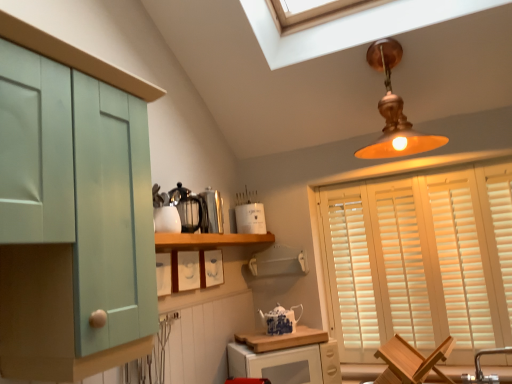
Question: Does wooden cutting board at lower center turn towards metallic silver kettle at center, placed as the 2th appliance when sorted from back to front?

Choices:
 (A) no
 (B) yes

Answer: (A)

Question: Does wooden cutting board at lower center have a lesser height compared to metallic silver kettle at center, which is counted as the 2th appliance, starting from the front?

Choices:
 (A) no
 (B) yes

Answer: (B)

Question: Does wooden cutting board at lower center have a larger size compared to metallic silver kettle at center, which is counted as the 2th appliance, starting from the front?

Choices:
 (A) no
 (B) yes

Answer: (B)

Question: From the image's perspective, is wooden cutting board at lower center above metallic silver kettle at center, placed as the 2th appliance when sorted from back to front?

Choices:
 (A) yes
 (B) no

Answer: (B)

Question: Can you confirm if wooden cutting board at lower center is thinner than metallic silver kettle at center, which is counted as the 2th appliance, starting from the front?

Choices:
 (A) no
 (B) yes

Answer: (A)

Question: Considering the positions of polished stainless steel kettle at upper center, acting as the first appliance starting from the front, and wooden chair at lower right in the image, is polished stainless steel kettle at upper center, acting as the first appliance starting from the front, bigger or smaller than wooden chair at lower right?

Choices:
 (A) small
 (B) big

Answer: (A)

Question: Is point (198, 208) positioned closer to the camera than point (412, 372)?

Choices:
 (A) farther
 (B) closer

Answer: (A)

Question: From their relative heights in the image, would you say polished stainless steel kettle at upper center, acting as the first appliance starting from the front, is taller or shorter than wooden chair at lower right?

Choices:
 (A) tall
 (B) short

Answer: (B)

Question: Is polished stainless steel kettle at upper center, acting as the third appliance starting from the back, spatially inside wooden chair at lower right, or outside of it?

Choices:
 (A) inside
 (B) outside

Answer: (B)

Question: Is brushed metal faucet at lower right wider or thinner than mint green wood cabinet at left, marked as the 1th cabinetry in a left-to-right arrangement?

Choices:
 (A) thin
 (B) wide

Answer: (A)

Question: Considering the positions of brushed metal faucet at lower right and mint green wood cabinet at left, marked as the 1th cabinetry in a left-to-right arrangement, in the image, is brushed metal faucet at lower right bigger or smaller than mint green wood cabinet at left, marked as the 1th cabinetry in a left-to-right arrangement,?

Choices:
 (A) big
 (B) small

Answer: (B)

Question: Visually, is brushed metal faucet at lower right positioned to the left or to the right of mint green wood cabinet at left, the first cabinetry in the top-to-bottom sequence?

Choices:
 (A) right
 (B) left

Answer: (A)

Question: In the image, is brushed metal faucet at lower right positioned in front of or behind mint green wood cabinet at left, which is the second cabinetry in back-to-front order?

Choices:
 (A) behind
 (B) front

Answer: (A)

Question: Considering their positions, is white wooden blinds at right located in front of or behind metallic silver kettle at center, which is counted as the 2th appliance, starting from the front?

Choices:
 (A) behind
 (B) front

Answer: (A)

Question: Is white wooden blinds at right spatially inside metallic silver kettle at center, placed as the 2th appliance when sorted from back to front, or outside of it?

Choices:
 (A) outside
 (B) inside

Answer: (A)